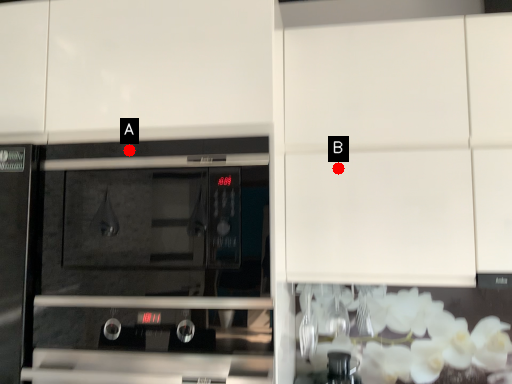
Question: Two points are circled on the image, labeled by A and B beside each circle. Which point is closer to the camera?

Choices:
 (A) A is closer
 (B) B is closer

Answer: (A)